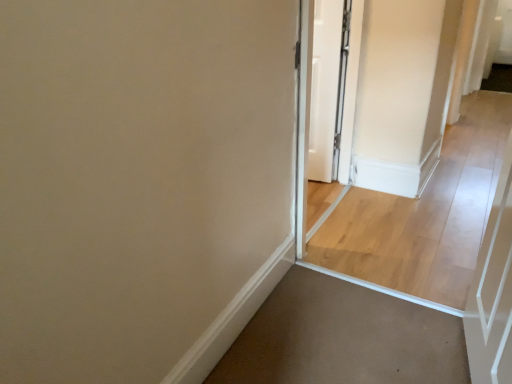
Question: Is white glossy door at center next to white glossy screen door at center and touching it?

Choices:
 (A) no
 (B) yes

Answer: (B)

Question: Is white glossy door at center wider than white glossy screen door at center?

Choices:
 (A) yes
 (B) no

Answer: (B)

Question: Considering the relative positions of white glossy door at center and white glossy screen door at center in the image provided, is white glossy door at center in front of white glossy screen door at center?

Choices:
 (A) no
 (B) yes

Answer: (A)

Question: Is white glossy door at center not inside white glossy screen door at center?

Choices:
 (A) no
 (B) yes

Answer: (B)

Question: Is white glossy door at center shorter than white glossy screen door at center?

Choices:
 (A) yes
 (B) no

Answer: (A)

Question: Looking at the image, does white glossy door at center seem bigger or smaller compared to white glossy screen door at center?

Choices:
 (A) big
 (B) small

Answer: (B)

Question: Choose the correct answer: Is white glossy door at center inside white glossy screen door at center or outside it?

Choices:
 (A) inside
 (B) outside

Answer: (B)

Question: From the image's perspective, is white glossy door at center above or below white glossy screen door at center?

Choices:
 (A) below
 (B) above

Answer: (B)

Question: Is white glossy door at center taller or shorter than white glossy screen door at center?

Choices:
 (A) short
 (B) tall

Answer: (A)

Question: Is light wood floor at center to the left or to the right of white glossy door at center in the image?

Choices:
 (A) right
 (B) left

Answer: (A)

Question: Is light wood floor at center spatially inside white glossy door at center, or outside of it?

Choices:
 (A) outside
 (B) inside

Answer: (A)

Question: Is light wood floor at center taller or shorter than white glossy door at center?

Choices:
 (A) short
 (B) tall

Answer: (A)

Question: Is light wood floor at center bigger or smaller than white glossy door at center?

Choices:
 (A) small
 (B) big

Answer: (B)

Question: In terms of size, does white glossy screen door at center appear bigger or smaller than light wood floor at center?

Choices:
 (A) small
 (B) big

Answer: (A)

Question: From the image's perspective, is white glossy screen door at center located above or below light wood floor at center?

Choices:
 (A) above
 (B) below

Answer: (B)